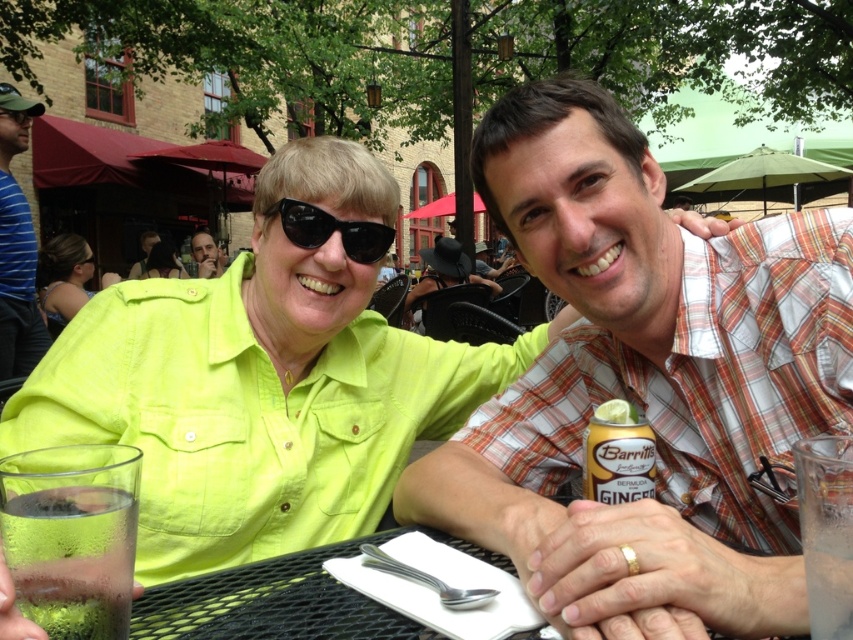
Question: Which of these objects is positioned farthest from the green matte lime at upper right?

Choices:
 (A) blue striped shirt at left
 (B) clear glass at lower right
 (C) matte black sunglasses at upper left
 (D) clear glass at lower left

Answer: (C)

Question: Can you confirm if clear glass at lower left is thinner than green matte lime at upper right?

Choices:
 (A) yes
 (B) no

Answer: (B)

Question: Among these points, which one is farthest from the camera?

Choices:
 (A) (x=32, y=328)
 (B) (x=202, y=243)

Answer: (B)

Question: Among these objects, which one is nearest to the camera?

Choices:
 (A) yellow matte can at center
 (B) green matte lime at upper right
 (C) blue striped shirt at left
 (D) matte black sunglasses at upper left

Answer: (A)

Question: Does plaid cotton shirt at center have a greater width compared to green matte lime at upper right?

Choices:
 (A) yes
 (B) no

Answer: (A)

Question: Can you confirm if black plastic sunglasses at upper center is positioned to the right of matte black sunglasses at upper left?

Choices:
 (A) yes
 (B) no

Answer: (A)